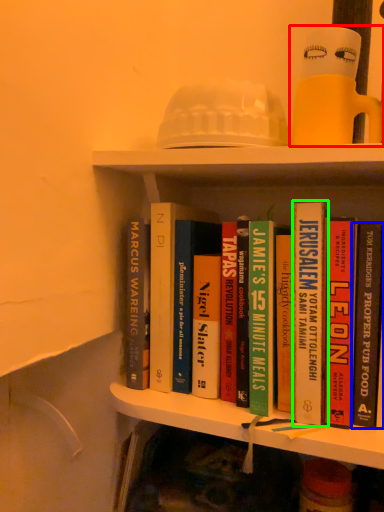
Question: Estimate the real-world distances between objects in this image. Which object is farther from toy (highlighted by a red box), book (highlighted by a blue box) or book (highlighted by a green box)?

Choices:
 (A) book
 (B) book

Answer: (A)